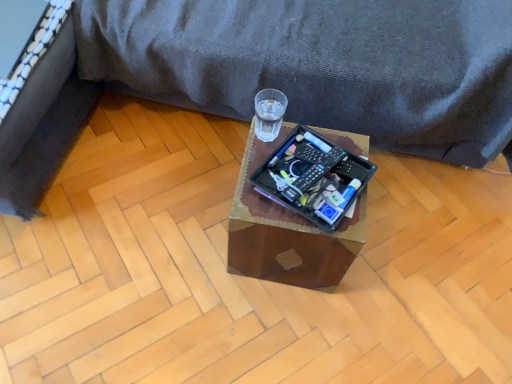
Question: Can you see black plastic remote control at center touching transparent glass at center?

Choices:
 (A) no
 (B) yes

Answer: (A)

Question: Is black plastic remote control at center positioned before transparent glass at center?

Choices:
 (A) no
 (B) yes

Answer: (A)

Question: From a real-world perspective, is black plastic remote control at center positioned under transparent glass at center based on gravity?

Choices:
 (A) yes
 (B) no

Answer: (B)

Question: Does black plastic remote control at center appear on the left side of transparent glass at center?

Choices:
 (A) no
 (B) yes

Answer: (B)

Question: Is black plastic remote control at center surrounding transparent glass at center?

Choices:
 (A) yes
 (B) no

Answer: (B)

Question: From the image's perspective, is transparent glass at center positioned above or below wooden tray at center?

Choices:
 (A) above
 (B) below

Answer: (A)

Question: From a real-world perspective, is transparent glass at center positioned above or below wooden tray at center?

Choices:
 (A) below
 (B) above

Answer: (B)

Question: Relative to wooden tray at center, is transparent glass at center in front or behind?

Choices:
 (A) behind
 (B) front

Answer: (A)

Question: Considering the positions of transparent glass at center and wooden tray at center in the image, is transparent glass at center bigger or smaller than wooden tray at center?

Choices:
 (A) small
 (B) big

Answer: (A)

Question: From a real-world perspective, is wooden tray at center physically located above or below transparent glass at center?

Choices:
 (A) above
 (B) below

Answer: (B)

Question: Considering the relative positions of wooden tray at center and transparent glass at center in the image provided, is wooden tray at center to the left or to the right of transparent glass at center?

Choices:
 (A) right
 (B) left

Answer: (A)

Question: Is point click(241, 218) positioned closer to the camera than point click(278, 104)?

Choices:
 (A) farther
 (B) closer

Answer: (B)

Question: Relative to transparent glass at center, is wooden tray at center in front or behind?

Choices:
 (A) front
 (B) behind

Answer: (A)

Question: Is black fabric bed frame at left bigger or smaller than black plastic remote control at center?

Choices:
 (A) big
 (B) small

Answer: (A)

Question: Considering the positions of black fabric bed frame at left and black plastic remote control at center in the image, is black fabric bed frame at left wider or thinner than black plastic remote control at center?

Choices:
 (A) thin
 (B) wide

Answer: (B)